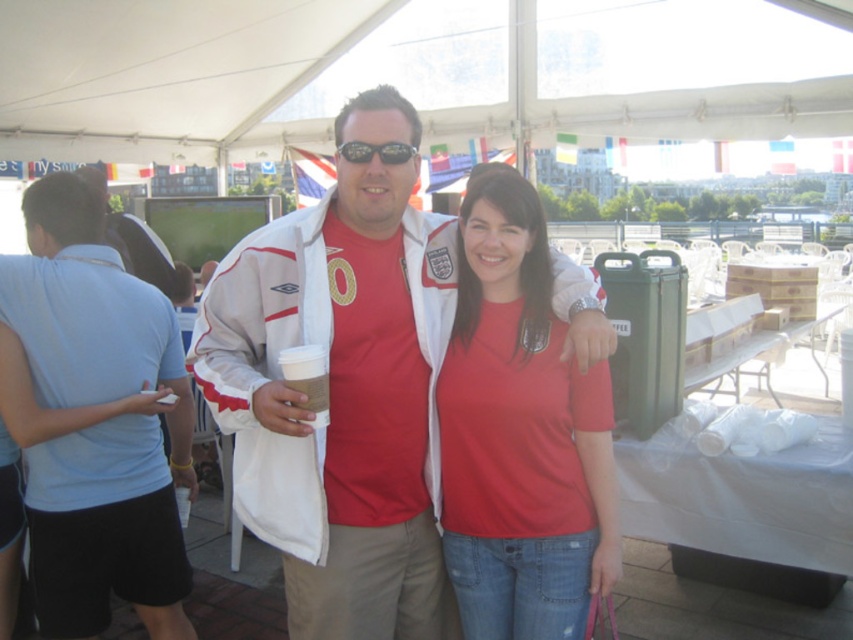
You are standing in the center of the tent and want to move towards the nearest point between point (241, 337) and point (154, 346). Which point should you walk towards?

Point (241, 337) is closer to the viewer than point (154, 346), so you should walk towards point (241, 337).